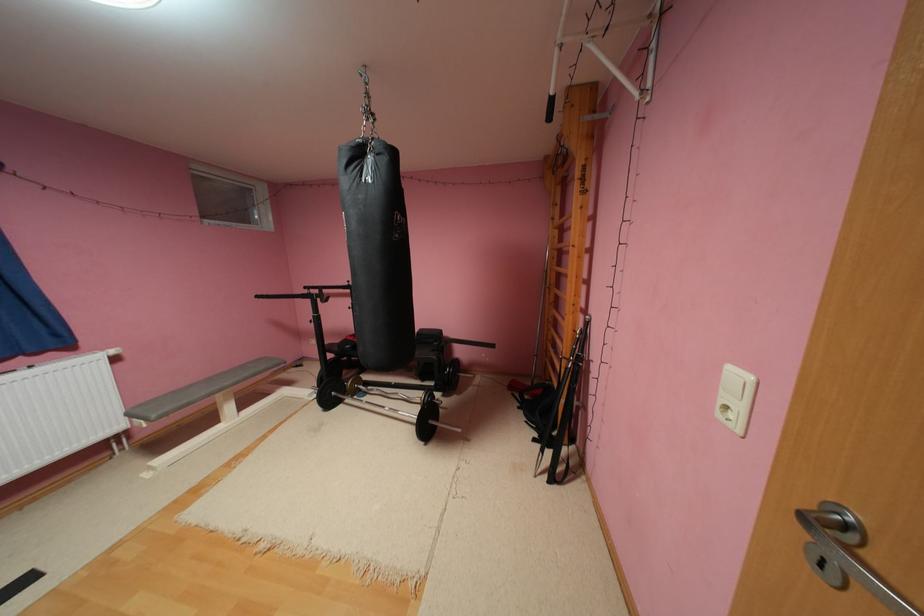
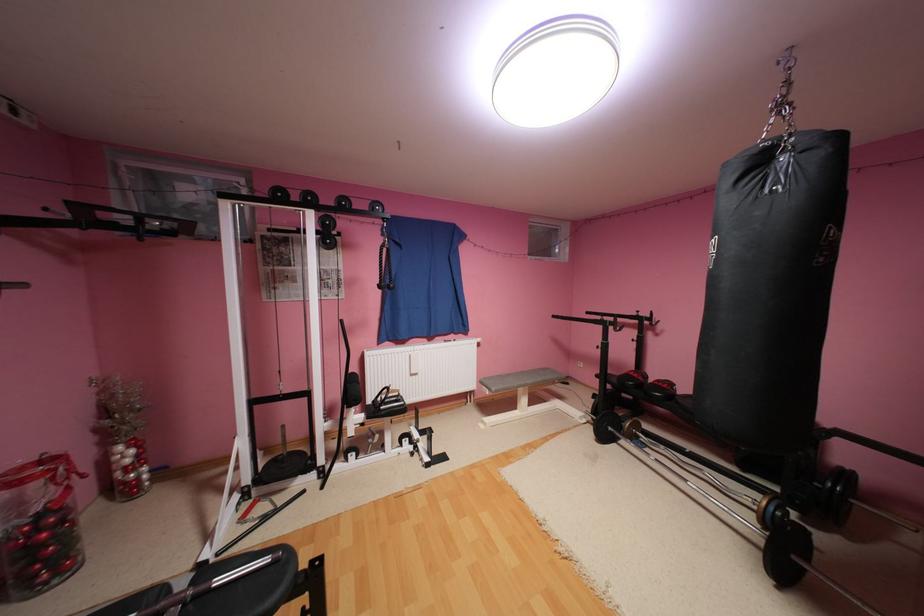
Locate, in the second image, the point that corresponds to (x=368, y=153) in the first image.

(769, 161)